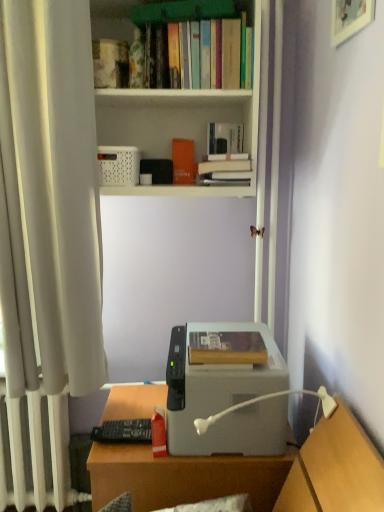
This screenshot has width=384, height=512. Describe the element at coordinates (350, 18) in the screenshot. I see `wooden picture frame at upper right` at that location.

Find the location of a particular element. The width and height of the screenshot is (384, 512). gray matte printer at center is located at coordinates (225, 389).

I want to click on white fabric curtain at left, so click(50, 199).

Is hardcover book at upper center, which ranks as the 1th book in back-to-front order, positioned before wooden picture frame at upper right?

No, hardcover book at upper center, which ranks as the 1th book in back-to-front order, is behind wooden picture frame at upper right.

From a real-world perspective, is hardcover book at upper center, the second book from the bottom, physically located above or below wooden picture frame at upper right?

In terms of real-world spatial position, hardcover book at upper center, the second book from the bottom, is below wooden picture frame at upper right.

How much distance is there between hardcover book at upper center, the second book from the bottom, and wooden picture frame at upper right?

hardcover book at upper center, the second book from the bottom, and wooden picture frame at upper right are 47.02 centimeters apart.

Is there a large distance between hardcover book at upper center, which ranks as the 1th book in back-to-front order, and wooden picture frame at upper right?

→ hardcover book at upper center, which ranks as the 1th book in back-to-front order, is near wooden picture frame at upper right, not far away.

Which of these two, hardcover book at upper center, which is counted as the third book, starting from the front, or hardcover book at center, arranged as the first book when viewed from the front, is bigger?

hardcover book at center, arranged as the first book when viewed from the front, is bigger.

Could you tell me if hardcover book at upper center, which ranks as the 1th book in back-to-front order, is turned towards hardcover book at center, marked as the 1th book in a bottom-to-top arrangement?

No, hardcover book at upper center, which ranks as the 1th book in back-to-front order, is not facing towards hardcover book at center, marked as the 1th book in a bottom-to-top arrangement.

Which of these two, hardcover book at upper center, which is counted as the third book, starting from the front, or hardcover book at center, placed as the third book when sorted from back to front, stands taller?

With more height is hardcover book at upper center, which is counted as the third book, starting from the front.

From the image's perspective, which is below, hardcover book at upper center, which is counted as the third book, starting from the front, or hardcover book at center, which is the 3th book in top-to-bottom order?

hardcover book at center, which is the 3th book in top-to-bottom order.

How far apart are white plastic lamp at lower center and white plastic radiator at left?

white plastic lamp at lower center and white plastic radiator at left are 34.78 inches apart from each other.

Considering the sizes of white plastic lamp at lower center and white plastic radiator at left in the image, is white plastic lamp at lower center taller or shorter than white plastic radiator at left?

Clearly, white plastic lamp at lower center is shorter compared to white plastic radiator at left.

Is white plastic lamp at lower center not close to white plastic radiator at left?

No, white plastic lamp at lower center is in close proximity to white plastic radiator at left.

Is white plastic lamp at lower center facing towards white plastic radiator at left?

No.

Considering the positions of objects white plastic radiator at left and hardcover books at upper center, which is the 1th book in top-to-bottom order, in the image provided, who is more to the right, white plastic radiator at left or hardcover books at upper center, which is the 1th book in top-to-bottom order,?

Positioned to the right is hardcover books at upper center, which is the 1th book in top-to-bottom order.

How many degrees apart are the facing directions of white plastic radiator at left and hardcover books at upper center, which is the 3th book in bottom-to-top order?

white plastic radiator at left and hardcover books at upper center, which is the 3th book in bottom-to-top order, are facing 1.31 degrees away from each other.

Is the position of white plastic radiator at left more distant than that of hardcover books at upper center, placed as the 2th book when sorted from front to back?

That is True.

The image size is (384, 512). Find the location of `radiator on the left of hardcover books at upper center, placed as the 2th book when sorted from front to back`. radiator on the left of hardcover books at upper center, placed as the 2th book when sorted from front to back is located at coordinates (37, 453).

Is hardcover books at upper center, placed as the 2th book when sorted from front to back, aimed at gray matte printer at center?

No.

Based on the photo, measure the distance from hardcover books at upper center, placed as the 2th book when sorted from front to back, to gray matte printer at center.

hardcover books at upper center, placed as the 2th book when sorted from front to back, is 1.11 meters from gray matte printer at center.

From the image's perspective, which one is positioned lower, hardcover books at upper center, which is the 3th book in bottom-to-top order, or gray matte printer at center?

gray matte printer at center appears lower in the image.

Is hardcover books at upper center, placed as the 2th book when sorted from front to back, with gray matte printer at center?

hardcover books at upper center, placed as the 2th book when sorted from front to back, is not next to gray matte printer at center, and they're not touching.

From the image's perspective, is white plastic radiator at left beneath white plastic bookcase at upper center?

Yes, from the image's perspective, white plastic radiator at left is beneath white plastic bookcase at upper center.

Measure the distance from white plastic radiator at left to white plastic bookcase at upper center.

1.08 meters.

Is white plastic radiator at left positioned before white plastic bookcase at upper center?

No, white plastic radiator at left is further to the viewer.

Between point (59, 466) and point (223, 92), which one is positioned in front?

The point (223, 92) is closer.

From the picture: From a real-world perspective, relative to white plastic lamp at lower center, is gray matte printer at center vertically above or below?

gray matte printer at center is situated lower than white plastic lamp at lower center in the real world.

Is gray matte printer at center wider or thinner than white plastic lamp at lower center?

Clearly, gray matte printer at center has less width compared to white plastic lamp at lower center.

Considering the relative positions of gray matte printer at center and white plastic lamp at lower center in the image provided, is gray matte printer at center in front of white plastic lamp at lower center?

That is False.

Locate an element on the screen. This screenshot has width=384, height=512. picture frame above the hardcover book at upper center, which is counted as the second book, starting from the top (from the image's perspective) is located at coordinates click(x=350, y=18).

Locate an element on the screen. book that is the 2nd object located behind the hardcover book at center, placed as the third book when sorted from back to front is located at coordinates (225, 156).

From the image, which object appears to be nearer to hardcover books at upper center, which is the 3th book in bottom-to-top order, white plastic lamp at lower center or gray matte printer at center?

The object closer to hardcover books at upper center, which is the 3th book in bottom-to-top order, is gray matte printer at center.

Considering their positions, is white plastic radiator at left positioned further to white plastic lamp at lower center than gray matte printer at center?

white plastic radiator at left.

From the image, which object appears to be farther from hardcover book at center, which is the 3th book in top-to-bottom order, wooden desk at lower center or gray matte printer at center?

Among the two, wooden desk at lower center is located further to hardcover book at center, which is the 3th book in top-to-bottom order.

Based on their spatial positions, is white plastic radiator at left or white fabric curtain at left further from white plastic bookcase at upper center?

white plastic radiator at left lies further to white plastic bookcase at upper center than the other object.

Based on their spatial positions, is hardcover book at center, marked as the 1th book in a bottom-to-top arrangement, or white plastic bookcase at upper center further from wooden desk at lower center?

white plastic bookcase at upper center is further to wooden desk at lower center.

Which object lies further to the anchor point gray matte printer at center, white plastic bookcase at upper center or orange matte paperback book at upper center?

white plastic bookcase at upper center is further to gray matte printer at center.

Which object lies nearer to the anchor point white plastic bookcase at upper center, white plastic radiator at left or white plastic lamp at lower center?

Among the two, white plastic lamp at lower center is located nearer to white plastic bookcase at upper center.

Estimate the real-world distances between objects in this image. Which object is further from wooden picture frame at upper right, white fabric curtain at left or white plastic bookcase at upper center?

The object further to wooden picture frame at upper right is white fabric curtain at left.

Where is `paperback book between hardcover books at upper center, the second book positioned from the back, and hardcover book at center, placed as the third book when sorted from back to front, in the vertical direction`? The width and height of the screenshot is (384, 512). paperback book between hardcover books at upper center, the second book positioned from the back, and hardcover book at center, placed as the third book when sorted from back to front, in the vertical direction is located at coordinates (183, 161).

Identify the location of book between white fabric curtain at left and wooden desk at lower center vertically. (227, 348).

Where is `curtain between orange matte paperback book at upper center and wooden desk at lower center vertically`? Image resolution: width=384 pixels, height=512 pixels. curtain between orange matte paperback book at upper center and wooden desk at lower center vertically is located at coordinates (50, 199).

The height and width of the screenshot is (512, 384). What are the coordinates of `curtain between wooden picture frame at upper right and wooden desk at lower center in the up-down direction` in the screenshot? It's located at (50, 199).